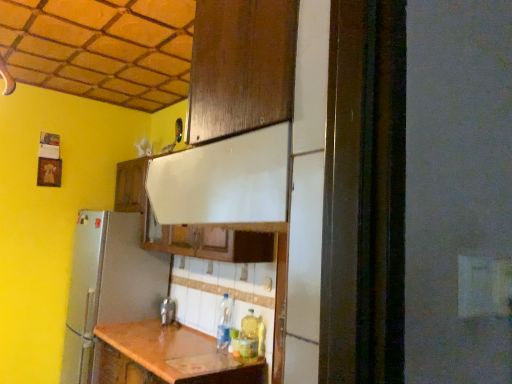
What do you see at coordinates (167, 311) in the screenshot?
I see `metallic silver faucet at center` at bounding box center [167, 311].

Image resolution: width=512 pixels, height=384 pixels. What are the coordinates of `translucent plastic bottle at lower center, positioned as the 1th bottle in right-to-left order` in the screenshot? It's located at (249, 335).

Identify the location of wooden cabinet at upper center. (131, 185).

Looking at their sizes, would you say metallic silver faucet at center is wider or thinner than wooden cabinet at upper center?

metallic silver faucet at center is thinner than wooden cabinet at upper center.

From a real-world perspective, which is physically above, metallic silver faucet at center or wooden cabinet at upper center?

wooden cabinet at upper center is physically above.

Does metallic silver faucet at center lie in front of wooden cabinet at upper center?

Yes.

Who is shorter, metallic silver faucet at center or wooden cabinet at upper center?

metallic silver faucet at center is shorter.

From a real-world perspective, starting from the wooden cabinet at upper center, which bottle is the 1st one below it? Please provide its 2D coordinates.

[(224, 322)]

Relative to clear plastic bottle at center, the 1th bottle in the back-to-front sequence, is wooden cabinet at upper center in front or behind?

Clearly, wooden cabinet at upper center is behind clear plastic bottle at center, the 1th bottle in the back-to-front sequence.

Is wooden cabinet at upper center positioned with its back to clear plastic bottle at center, which is counted as the 2th bottle, starting from the right?

wooden cabinet at upper center is not turned away from clear plastic bottle at center, which is counted as the 2th bottle, starting from the right.

How different are the orientations of clear plastic bottle at center, which is counted as the 2th bottle, starting from the right, and translucent plastic bottle at lower center, the second bottle when ordered from left to right, in degrees?

The angular difference between clear plastic bottle at center, which is counted as the 2th bottle, starting from the right, and translucent plastic bottle at lower center, the second bottle when ordered from left to right, is 0.00492 degrees.

Is clear plastic bottle at center, which is counted as the 2th bottle, starting from the right, in front of or behind translucent plastic bottle at lower center, acting as the second bottle starting from the back, in the image?

clear plastic bottle at center, which is counted as the 2th bottle, starting from the right, is positioned farther from the viewer than translucent plastic bottle at lower center, acting as the second bottle starting from the back.

Does point (219, 321) lie behind point (246, 336)?

Yes.

Is clear plastic bottle at center, the 1th bottle in the back-to-front sequence, wider or thinner than translucent plastic bottle at lower center, the second bottle when ordered from left to right?

Clearly, clear plastic bottle at center, the 1th bottle in the back-to-front sequence, has more width compared to translucent plastic bottle at lower center, the second bottle when ordered from left to right.

Which of these two, translucent plastic bottle at lower center, the second bottle when ordered from left to right, or clear plastic bottle at center, the first bottle from the left, stands shorter?

translucent plastic bottle at lower center, the second bottle when ordered from left to right, is shorter.

From the image's perspective, which is below, translucent plastic bottle at lower center, the second bottle when ordered from left to right, or clear plastic bottle at center, the 2th bottle in the front-to-back sequence?

translucent plastic bottle at lower center, the second bottle when ordered from left to right, appears lower in the image.

Based on their sizes in the image, would you say translucent plastic bottle at lower center, the second bottle when ordered from left to right, is bigger or smaller than clear plastic bottle at center, which is counted as the 2th bottle, starting from the right?

In the image, translucent plastic bottle at lower center, the second bottle when ordered from left to right, appears to be smaller than clear plastic bottle at center, which is counted as the 2th bottle, starting from the right.

Between translucent plastic bottle at lower center, which is the first bottle in front-to-back order, and clear plastic bottle at center, the 2th bottle in the front-to-back sequence, which one is positioned behind?

clear plastic bottle at center, the 2th bottle in the front-to-back sequence, is more distant.

Is translucent plastic bottle at lower center, the second bottle when ordered from left to right, next to wooden cabinet at upper center and touching it?

There is a gap between translucent plastic bottle at lower center, the second bottle when ordered from left to right, and wooden cabinet at upper center.

Consider the image. Can you confirm if translucent plastic bottle at lower center, which is the first bottle in front-to-back order, is smaller than wooden cabinet at upper center?

Correct, translucent plastic bottle at lower center, which is the first bottle in front-to-back order, occupies less space than wooden cabinet at upper center.

Does translucent plastic bottle at lower center, the second bottle when ordered from left to right, turn towards wooden cabinet at upper center?

No, translucent plastic bottle at lower center, the second bottle when ordered from left to right, is not aimed at wooden cabinet at upper center.

Is point (253, 316) positioned in front of point (127, 203)?

That is True.

Can you tell me how much translucent plastic bottle at lower center, positioned as the 1th bottle in right-to-left order, and metallic silver faucet at center differ in facing direction?

0.00489 degrees.

Is the depth of translucent plastic bottle at lower center, positioned as the 1th bottle in right-to-left order, less than that of metallic silver faucet at center?

Yes.

From the image's perspective, would you say translucent plastic bottle at lower center, acting as the second bottle starting from the back, is positioned over metallic silver faucet at center?

Yes.

Is translucent plastic bottle at lower center, positioned as the 1th bottle in right-to-left order, spatially inside metallic silver faucet at center, or outside of it?

translucent plastic bottle at lower center, positioned as the 1th bottle in right-to-left order, cannot be found inside metallic silver faucet at center.

Can you tell me how much wooden cabinet at upper center and translucent plastic bottle at lower center, which is the first bottle in front-to-back order, differ in facing direction?

0.00297 degrees.

Looking at this image, can you confirm if wooden cabinet at upper center is wider than translucent plastic bottle at lower center, positioned as the 1th bottle in right-to-left order?

Yes, wooden cabinet at upper center is wider than translucent plastic bottle at lower center, positioned as the 1th bottle in right-to-left order.

Can we say wooden cabinet at upper center lies outside translucent plastic bottle at lower center, which is the first bottle in front-to-back order?

wooden cabinet at upper center is positioned outside translucent plastic bottle at lower center, which is the first bottle in front-to-back order.

From the image's perspective, which bottle is the 2nd one below the wooden cabinet at upper center? Please provide its 2D coordinates.

[(249, 335)]

Where is `silver in front of the wooden cabinet at upper center`? Image resolution: width=512 pixels, height=384 pixels. silver in front of the wooden cabinet at upper center is located at coordinates (167, 311).

Identify the location of cabinetry on the left of clear plastic bottle at center, which is counted as the 2th bottle, starting from the right. (131, 185).

Estimate the real-world distances between objects in this image. Which object is closer to metallic silver faucet at center, wooden cabinet at upper center or translucent plastic bottle at lower center, the second bottle when ordered from left to right?

Based on the image, translucent plastic bottle at lower center, the second bottle when ordered from left to right, appears to be nearer to metallic silver faucet at center.

Estimate the real-world distances between objects in this image. Which object is further from clear plastic bottle at center, which is counted as the 2th bottle, starting from the right, wooden cabinet at upper center or translucent plastic bottle at lower center, the second bottle when ordered from left to right?

Among the two, wooden cabinet at upper center is located further to clear plastic bottle at center, which is counted as the 2th bottle, starting from the right.

Based on their spatial positions, is metallic silver faucet at center or wooden cabinet at upper center closer to translucent plastic bottle at lower center, acting as the second bottle starting from the back?

metallic silver faucet at center.

When comparing their distances from translucent plastic bottle at lower center, the second bottle when ordered from left to right, does clear plastic bottle at center, the 2th bottle in the front-to-back sequence, or metallic silver faucet at center seem further?

metallic silver faucet at center is positioned further to the anchor translucent plastic bottle at lower center, the second bottle when ordered from left to right.

Which object lies further to the anchor point translucent plastic bottle at lower center, positioned as the 1th bottle in right-to-left order, clear plastic bottle at center, the 1th bottle in the back-to-front sequence, or wooden cabinet at upper center?

wooden cabinet at upper center is positioned further to the anchor translucent plastic bottle at lower center, positioned as the 1th bottle in right-to-left order.

Which object lies nearer to the anchor point wooden cabinet at upper center, metallic silver faucet at center or clear plastic bottle at center, the 1th bottle in the back-to-front sequence?

metallic silver faucet at center is positioned closer to the anchor wooden cabinet at upper center.

Based on the photo, based on their spatial positions, is wooden cabinet at upper center or metallic silver faucet at center closer to translucent plastic bottle at lower center, acting as the second bottle starting from the back?

Among the two, metallic silver faucet at center is located nearer to translucent plastic bottle at lower center, acting as the second bottle starting from the back.

Which object lies further to the anchor point clear plastic bottle at center, the 2th bottle in the front-to-back sequence, wooden cabinet at upper center or metallic silver faucet at center?

wooden cabinet at upper center lies further to clear plastic bottle at center, the 2th bottle in the front-to-back sequence, than the other object.

At what (x,y) coordinates should I click in order to perform the action: click on bottle between wooden cabinet at upper center and translucent plastic bottle at lower center, positioned as the 1th bottle in right-to-left order, vertically. Please return your answer as a coordinate pair (x, y). Looking at the image, I should click on (224, 322).

Identify the location of bottle between translucent plastic bottle at lower center, which is the first bottle in front-to-back order, and metallic silver faucet at center, along the z-axis. This screenshot has width=512, height=384. (x=224, y=322).